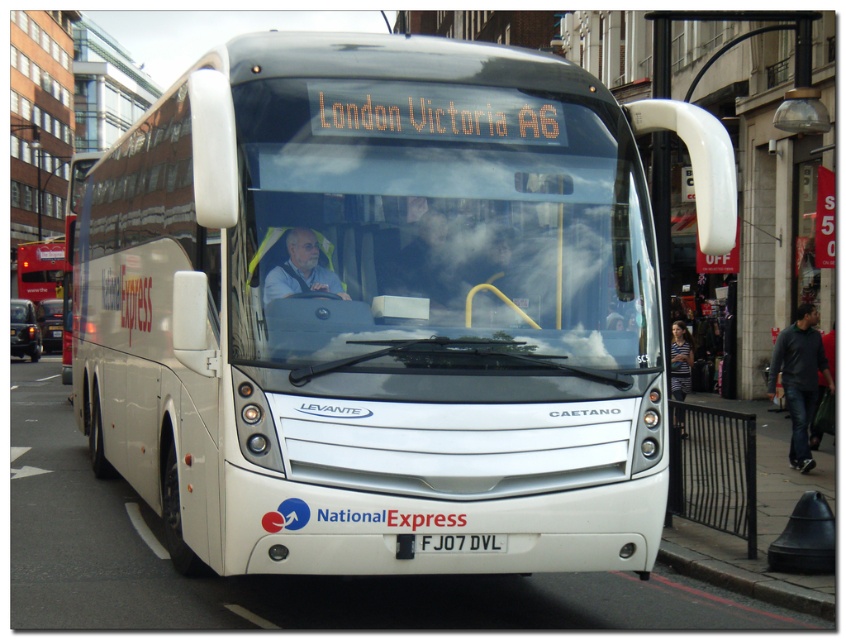
Question: Does white matte bus at center have a lesser width compared to transparent glass windshield at center?

Choices:
 (A) yes
 (B) no

Answer: (A)

Question: Which point is closer to the camera?

Choices:
 (A) transparent glass windshield at center
 (B) matte white bus at left

Answer: (A)

Question: Can you confirm if dark gray jeans at lower right is wider than matte white bus at left?

Choices:
 (A) no
 (B) yes

Answer: (A)

Question: Which object is the closest to the matte white bus at left?

Choices:
 (A) white matte bus at center
 (B) transparent glass windshield at center
 (C) light beige fabric jacket at center
 (D) dark gray jeans at lower right

Answer: (B)

Question: Which of the following is the closest to the observer?

Choices:
 (A) white plastic license plate at center
 (B) matte white bus at left
 (C) dark gray jeans at lower right

Answer: (A)

Question: Does white matte bus at center have a lesser width compared to matte white bus at left?

Choices:
 (A) yes
 (B) no

Answer: (A)